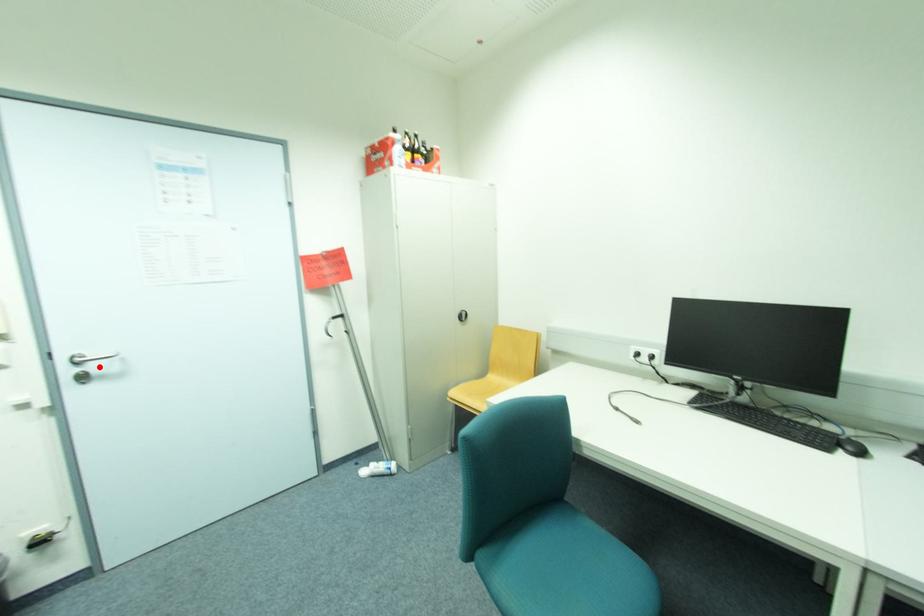
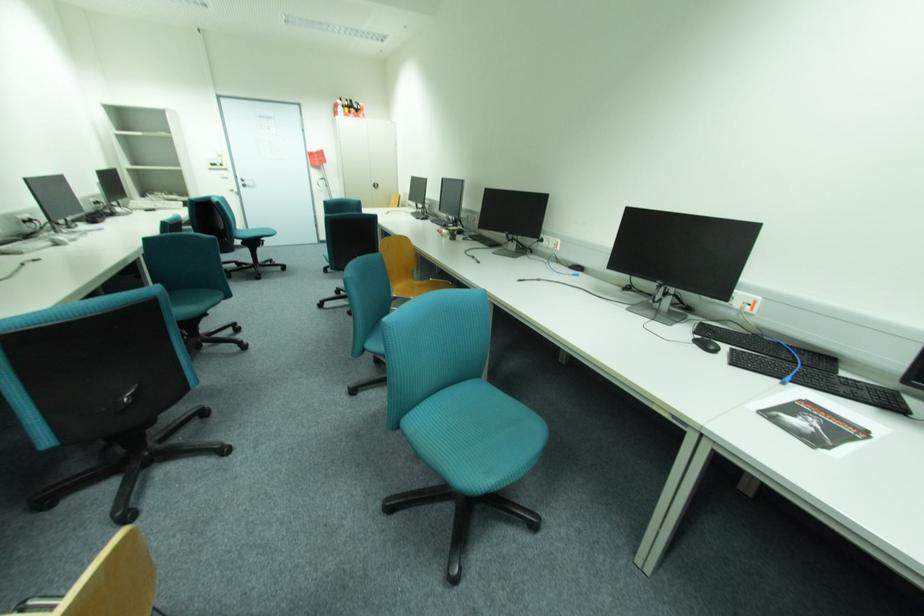
Find the pixel in the second image that matches the highlighted location in the first image.

(253, 183)